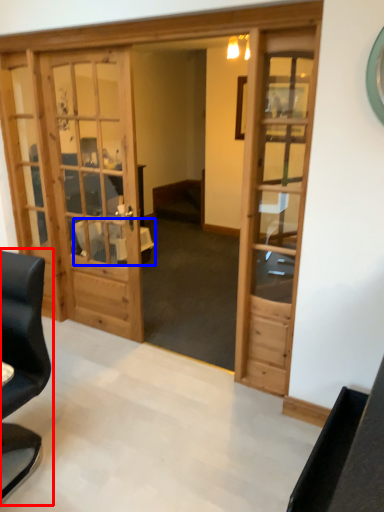
Question: Which object appears farthest to the camera in this image, chair (highlighted by a red box) or table (highlighted by a blue box)?

Choices:
 (A) chair
 (B) table

Answer: (B)